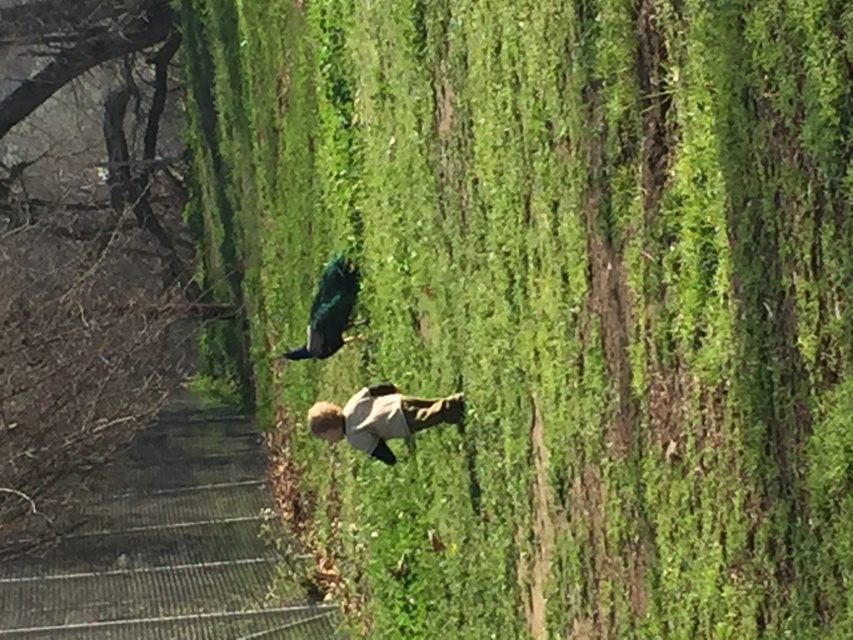
Question: Is metallic fence at lower left wider than light beige cotton pants at center?

Choices:
 (A) yes
 (B) no

Answer: (A)

Question: Does metallic fence at lower left appear over shiny teal bird at center?

Choices:
 (A) yes
 (B) no

Answer: (B)

Question: Which object is farther from the camera taking this photo?

Choices:
 (A) shiny teal bird at center
 (B) light beige cotton pants at center

Answer: (A)

Question: Is metallic fence at lower left above light beige cotton pants at center?

Choices:
 (A) yes
 (B) no

Answer: (B)

Question: Which of the following is the closest to the observer?

Choices:
 (A) (16, 605)
 (B) (383, 451)
 (C) (334, 284)

Answer: (B)

Question: Based on their relative distances, which object is farther from the light beige cotton pants at center?

Choices:
 (A) metallic fence at lower left
 (B) shiny teal bird at center

Answer: (A)